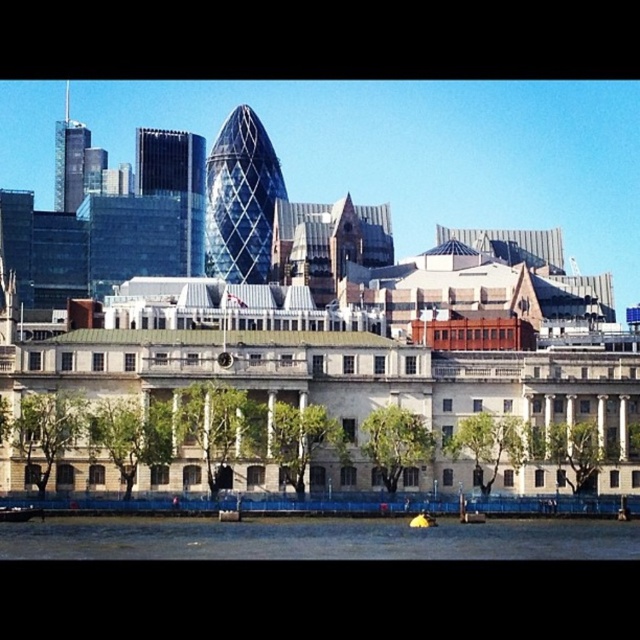
You are a tourist standing at the edge of the city park near the historic building. You want to take a photo that includes both the dark blue water at lower center and the yellow rubber boat at lower left. Which object should you position closer to the bottom of your camera frame to ensure both are visible?

You should position the yellow rubber boat at lower left closer to the bottom of your camera frame because the dark blue water at lower center has a greater height and will occupy more vertical space, allowing both to fit within the frame.